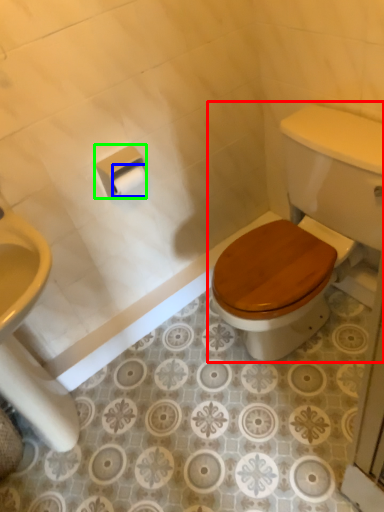
Question: Estimate the real-world distances between objects in this image. Which object is farther from toilet (highlighted by a red box), toilet paper (highlighted by a blue box) or toilet paper (highlighted by a green box)?

Choices:
 (A) toilet paper
 (B) toilet paper

Answer: (A)